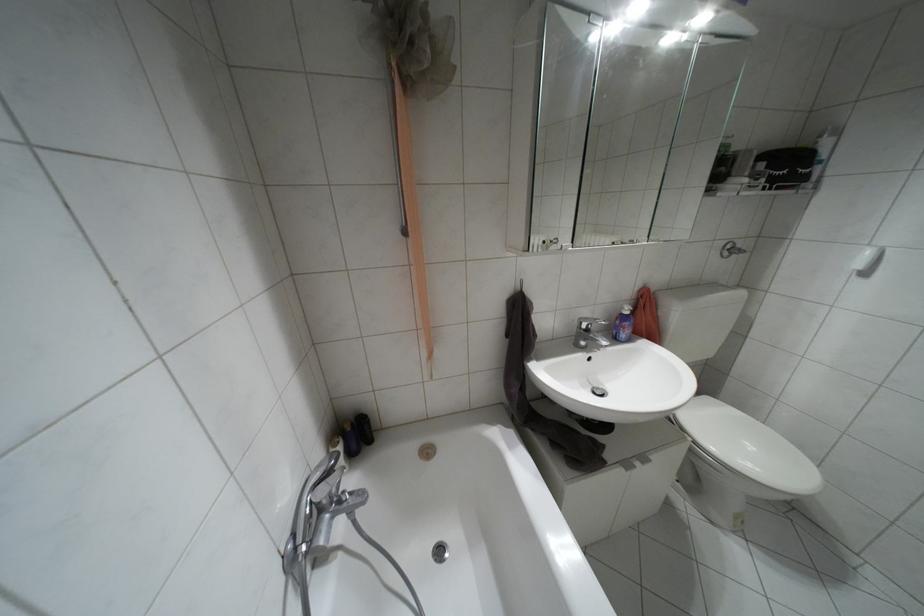
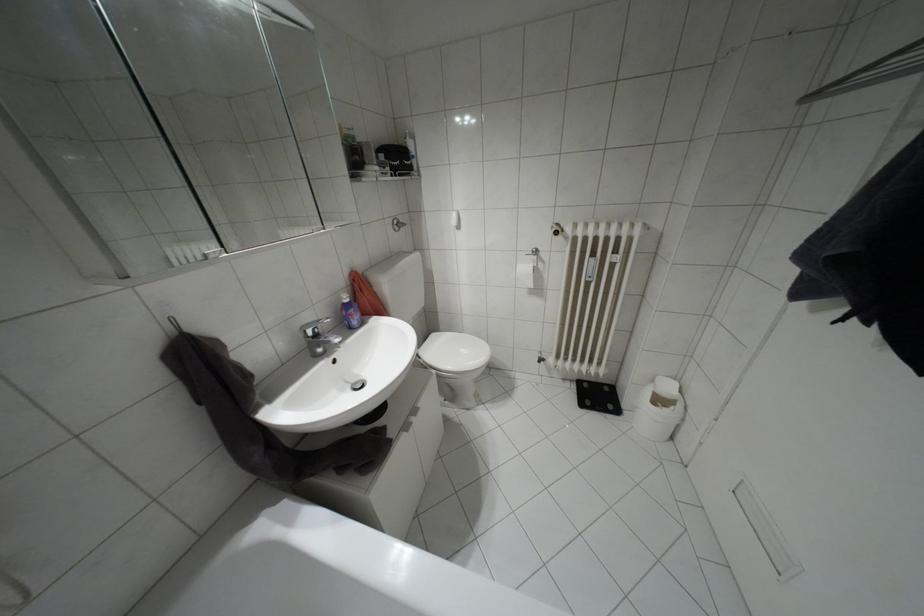
Locate, in the second image, the point that corresponds to the point at 723,254 in the first image.

(395, 229)